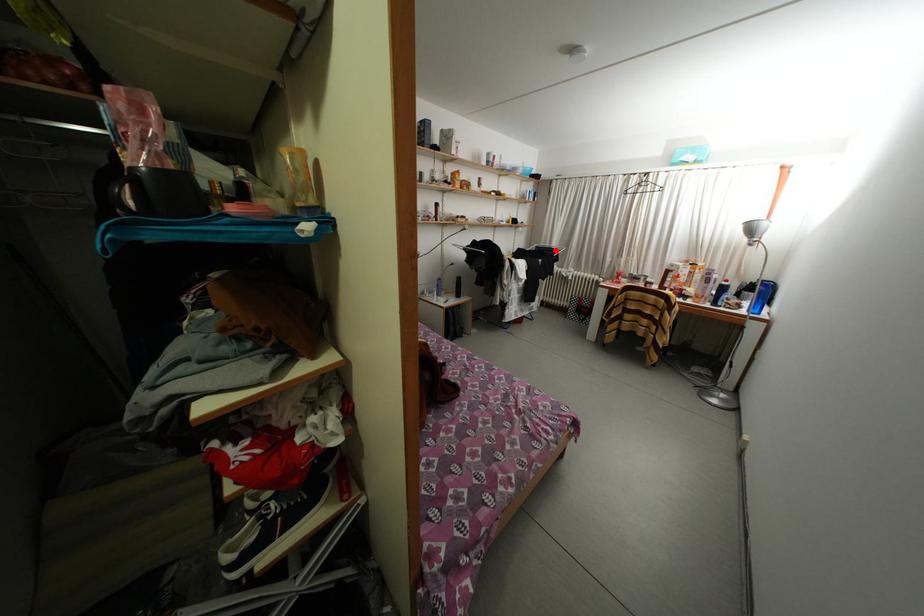
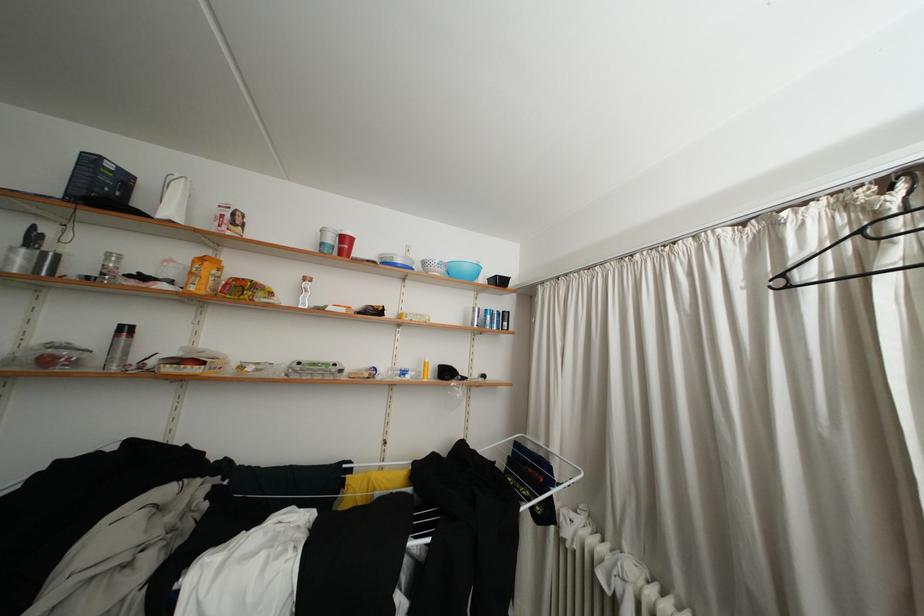
Find the pixel in the second image that matches the highlighted location in the first image.

(550, 448)